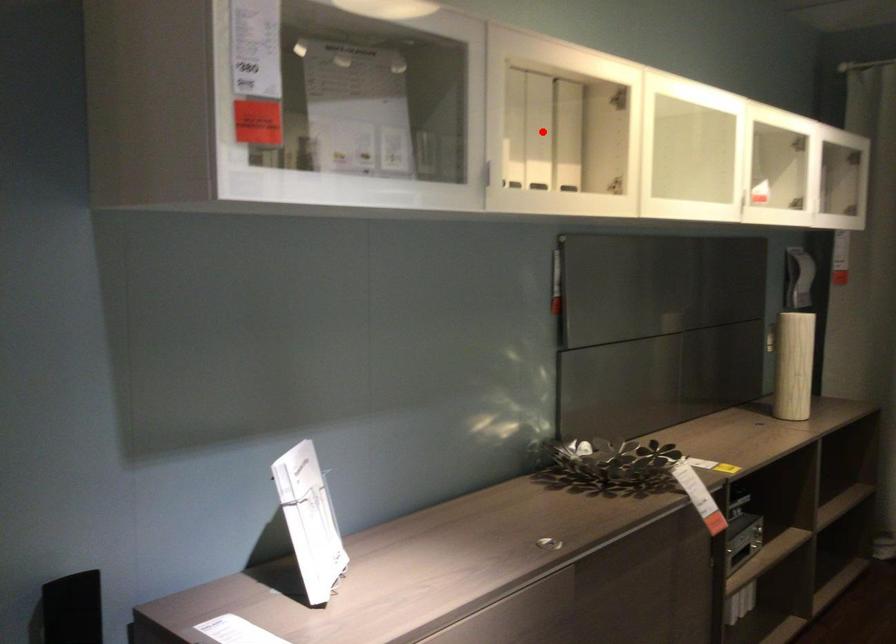
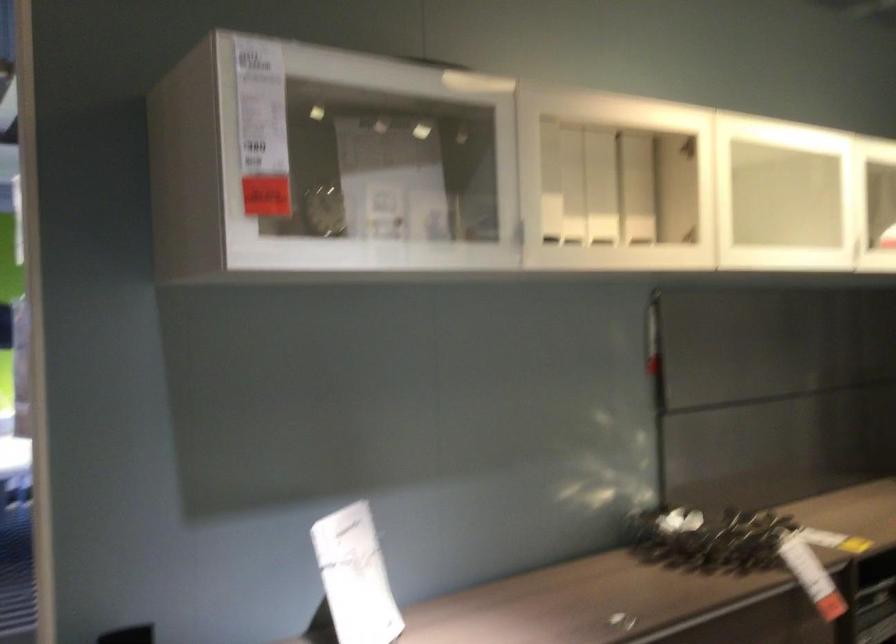
The point at the highlighted location is marked in the first image. Where is the corresponding point in the second image?

(600, 187)